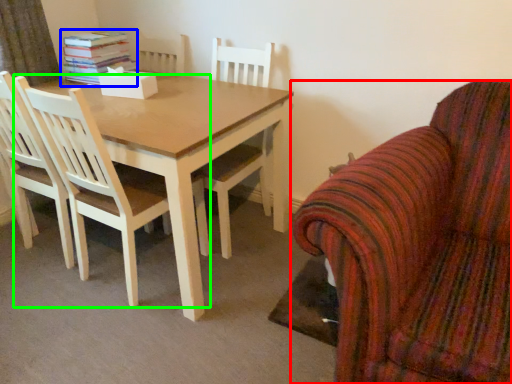
Question: Based on their relative distances, which object is farther from chair (highlighted by a red box)? Choose from book (highlighted by a blue box) and chair (highlighted by a green box).

Choices:
 (A) book
 (B) chair

Answer: (A)